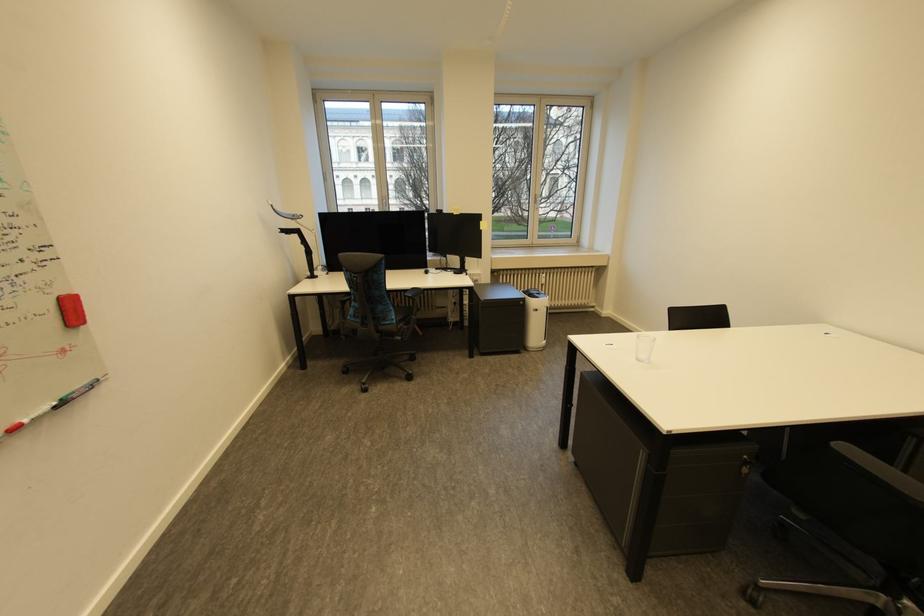
Where would you lift the whiteboard marker? Please return your answer as a coordinate pair (x, y).

(26, 419)